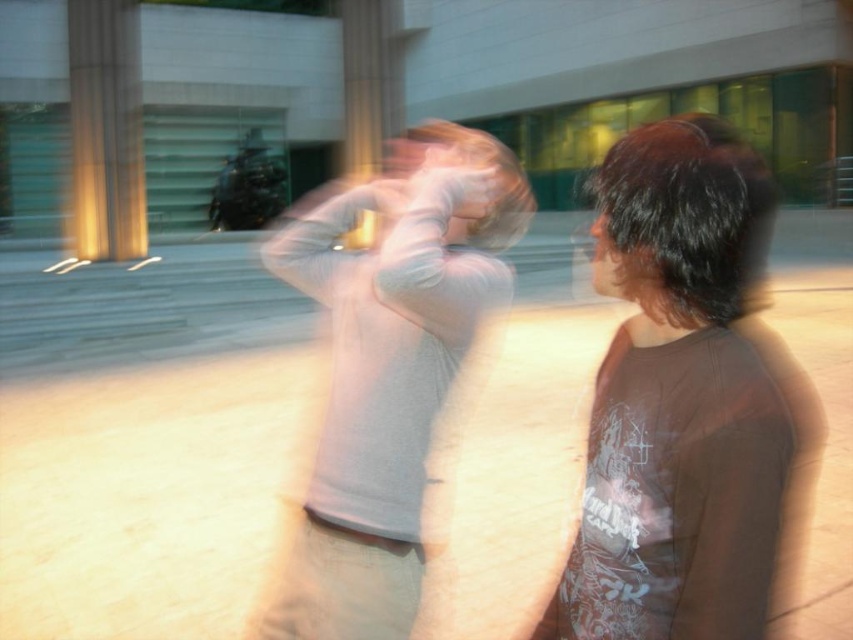
Looking at this image, you are a photographer trying to focus on the golden polished pillar at left in the image. However, the light gray cotton shirt at center is blocking your view. Can you move closer to the pillar without stepping over the person in the foreground?

The light gray cotton shirt at center is closer to the viewer than the golden polished pillar at left, so moving closer to the pillar would require moving past the foreground person to get an unobstructed view.